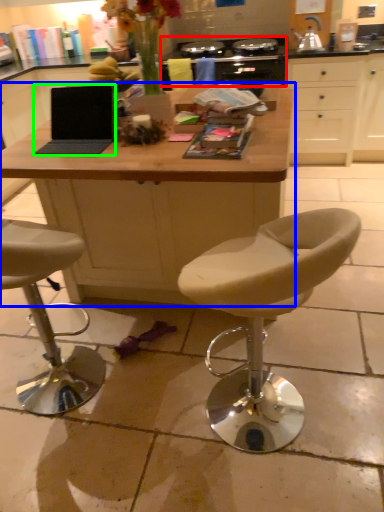
Question: Estimate the real-world distances between objects in this image. Which object is closer to gas stove (highlighted by a red box), desk (highlighted by a blue box) or laptop (highlighted by a green box)?

Choices:
 (A) desk
 (B) laptop

Answer: (A)